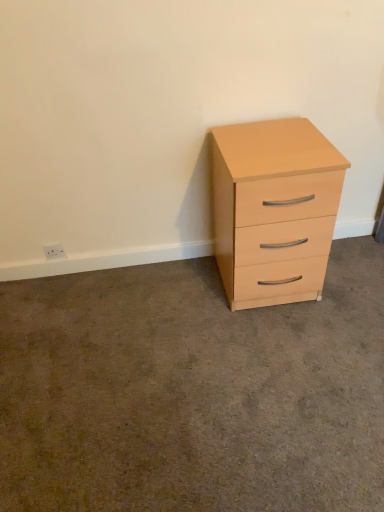
I want to click on free spot to the left of matte wood chest of drawers at right, so click(180, 295).